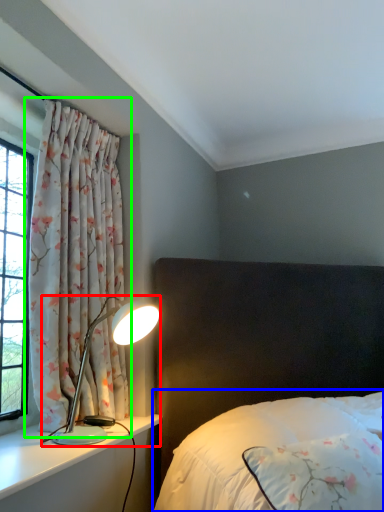
Question: Based on their relative distances, which object is nearer to lamp (highlighted by a red box)? Choose from bed (highlighted by a blue box) and curtain (highlighted by a green box).

Choices:
 (A) bed
 (B) curtain

Answer: (B)